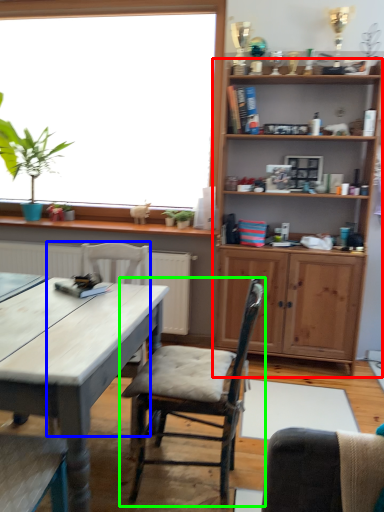
Question: Estimate the real-world distances between objects in this image. Which object is closer to shelf (highlighted by a red box), chair (highlighted by a blue box) or chair (highlighted by a green box)?

Choices:
 (A) chair
 (B) chair

Answer: (A)